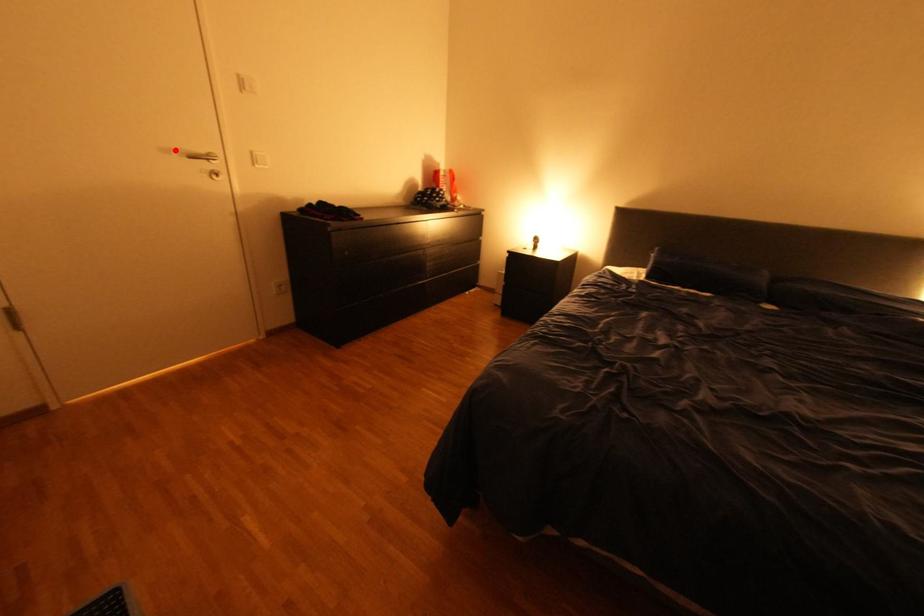
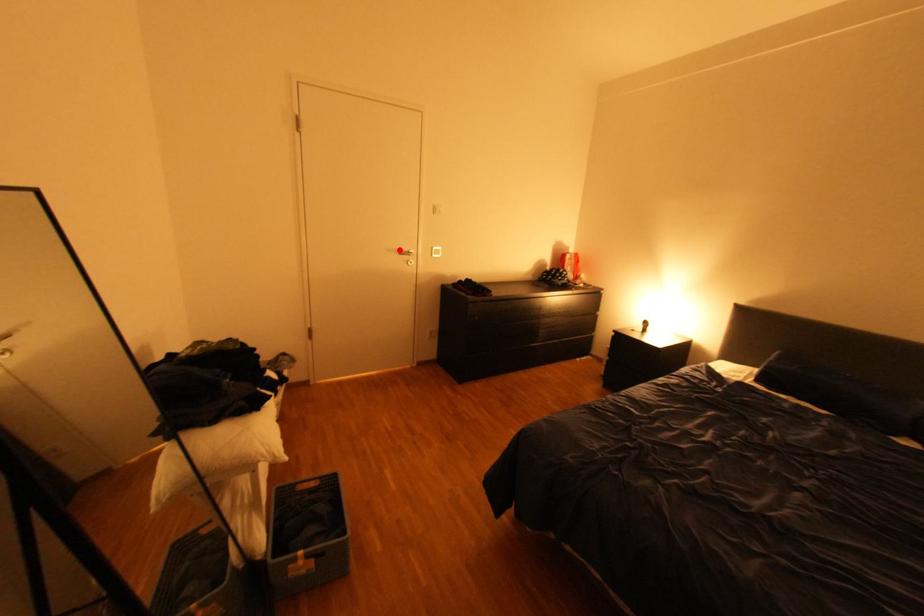
I am providing you with two images of the same scene from different viewpoints. A red point is marked on the first image and another point is marked on the second image. Does the point marked in image1 correspond to the same location as the one in image2?

Yes